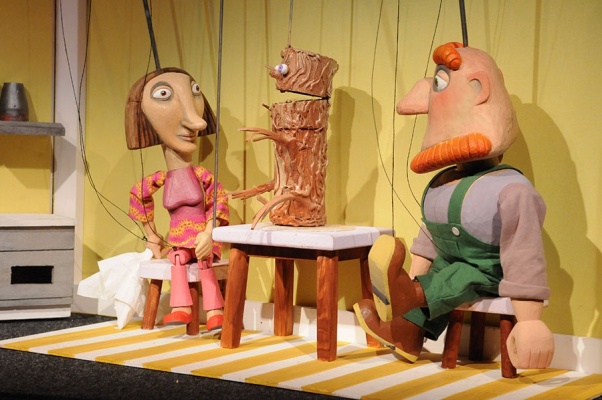
Locate an element on the screen. The height and width of the screenshot is (400, 602). yellow wall background is located at coordinates click(x=99, y=45), click(x=336, y=25), click(x=595, y=70), click(x=362, y=164).